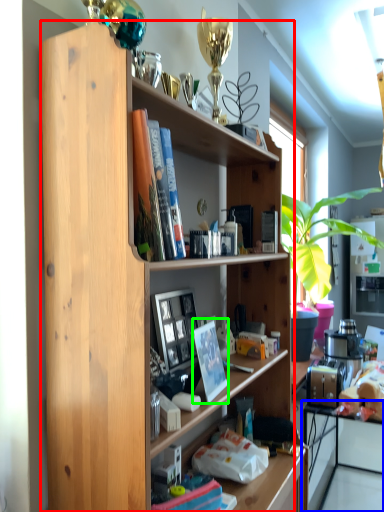
Question: Based on their relative distances, which object is farther from shelf (highlighted by a red box)? Choose from computer (highlighted by a blue box) and paperback book (highlighted by a green box).

Choices:
 (A) computer
 (B) paperback book

Answer: (A)